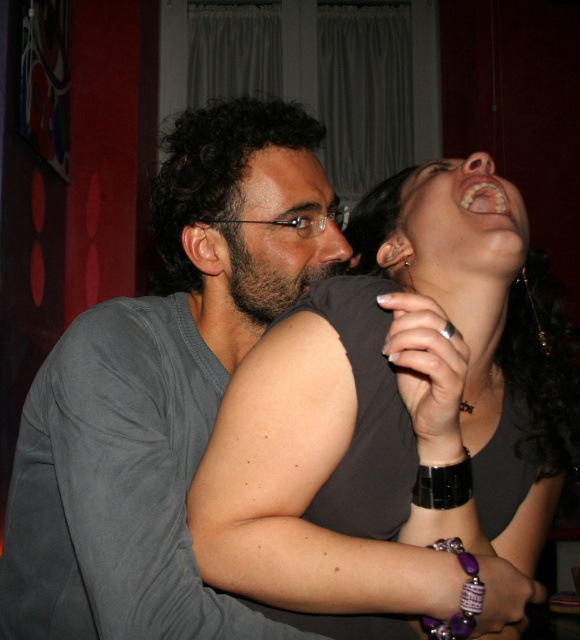
Is point (438, 424) positioned before point (488, 211)?

That is True.

Does matte gray tank top at center come behind white glossy teeth at upper center?

No.

Does point (516, 499) lie behind point (493, 200)?

Yes, it is.

At what (x,y) coordinates should I click in order to perform the action: click on matte gray tank top at center. Please return your answer as a coordinate pair (x, y). Looking at the image, I should click on coord(397,419).

Looking at this image, can you confirm if matte gray tank top at center is positioned above gray matte shirt at center?

No.

What do you see at coordinates (397, 419) in the screenshot? I see `matte gray tank top at center` at bounding box center [397, 419].

Which is in front, point (494, 572) or point (160, 312)?

Point (494, 572) is more forward.

Where is `matte gray tank top at center`? The image size is (580, 640). matte gray tank top at center is located at coordinates (397, 419).

Consider the image. Is gray matte shirt at center thinner than white glossy teeth at upper center?

No, gray matte shirt at center is not thinner than white glossy teeth at upper center.

Is point (172, 429) positioned in front of point (493, 196)?

No, it is behind (493, 196).

Does point (226, 241) come farther from viewer compared to point (474, 204)?

Yes, it is behind point (474, 204).

The width and height of the screenshot is (580, 640). Find the location of `gray matte shirt at center`. gray matte shirt at center is located at coordinates (160, 392).